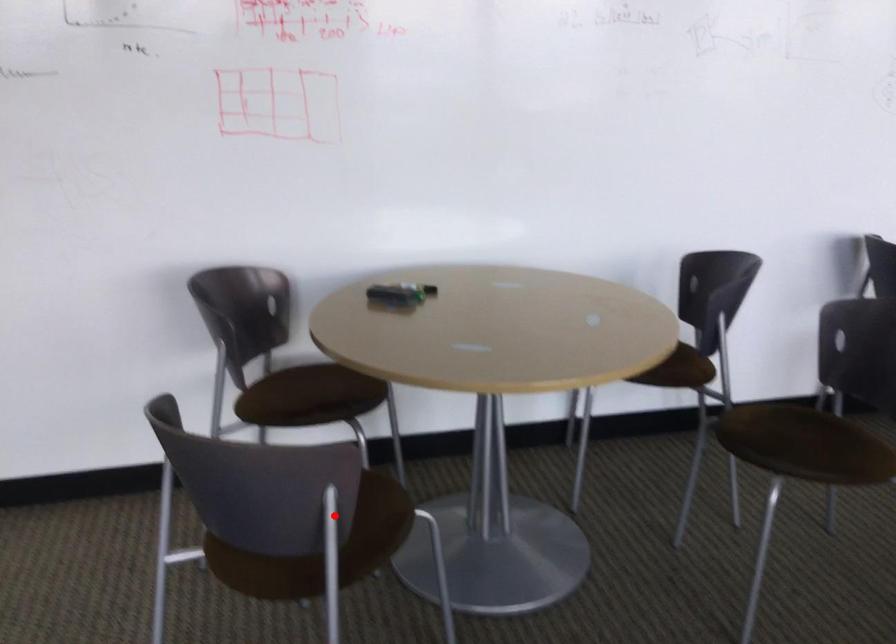
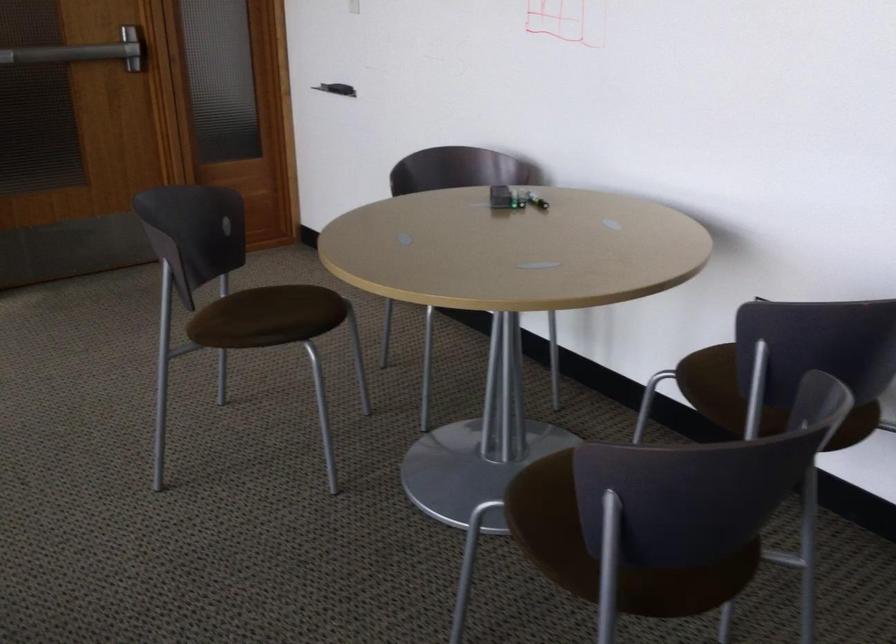
Find the pixel in the second image that matches the highlighted location in the first image.

(276, 317)